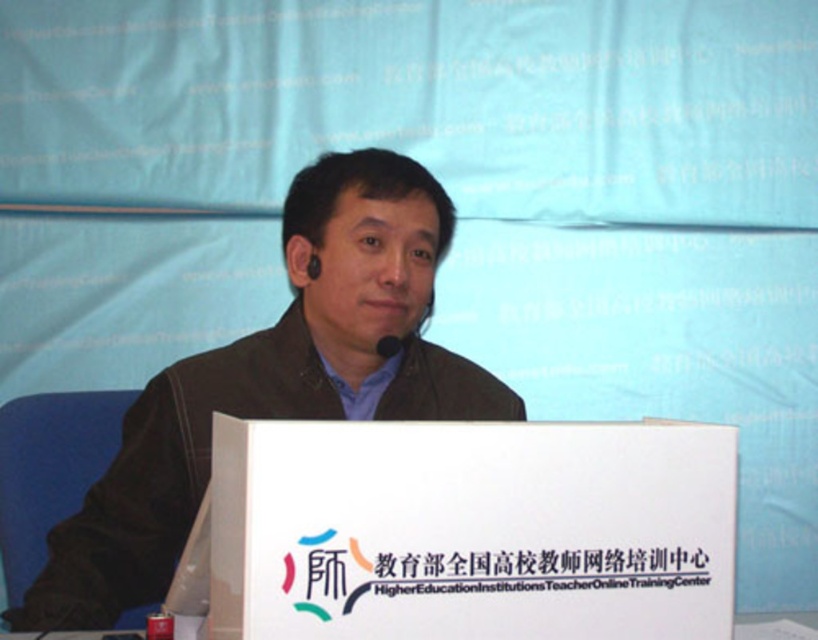
What do you see at coordinates (470, 531) in the screenshot? I see `white cardboard box at center` at bounding box center [470, 531].

Is white cardboard box at center to the left of matte black jacket at center from the viewer's perspective?

In fact, white cardboard box at center is to the right of matte black jacket at center.

You are a GUI agent. You are given a task and a screenshot of the screen. Output one action in this format:
    pyautogui.click(x=<x>, y=<y>)
    Task: Click on the white cardboard box at center
    This screenshot has width=818, height=640.
    Given the screenshot: What is the action you would take?
    pyautogui.click(x=470, y=531)

Can you confirm if white paper at center is positioned to the left of black matte microphone at center?

In fact, white paper at center is to the right of black matte microphone at center.

Is white paper at center further to camera compared to black matte microphone at center?

That is False.

The image size is (818, 640). In order to click on white paper at center in this screenshot , I will do `click(502, 570)`.

Find the location of a particular element. This screenshot has height=640, width=818. white paper at center is located at coordinates (502, 570).

Is point (596, 625) behind point (389, 333)?

No, it is in front of (389, 333).

Which is in front, point (412, 570) or point (389, 355)?

Point (412, 570)

Find the location of `white cardboard box at center`. white cardboard box at center is located at coordinates pyautogui.click(x=470, y=531).